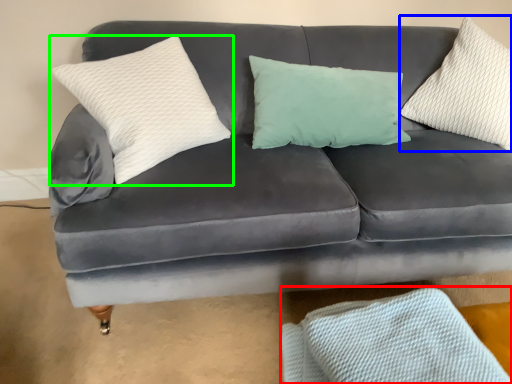
Question: Which is farther away from material (highlighted by a red box)? pillow (highlighted by a blue box) or pillow (highlighted by a green box)?

Choices:
 (A) pillow
 (B) pillow

Answer: (A)